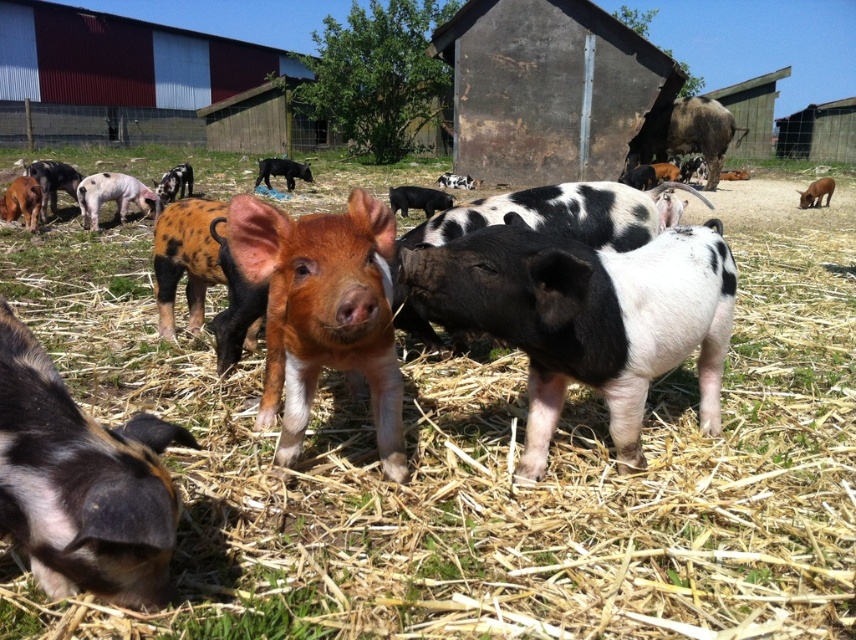
Between black and white speckled pig at center and brown furry piglet at center, which one has less height?

brown furry piglet at center is shorter.

Who is taller, black and white speckled pig at center or brown furry piglet at center?

Standing taller between the two is black and white speckled pig at center.

Locate an element on the screen. The height and width of the screenshot is (640, 856). black and white speckled pig at center is located at coordinates (586, 317).

Locate an element on the screen. black and white speckled pig at center is located at coordinates (586, 317).

Which is below, black and white speckled piglet at center or brown speckled piglet at lower left?

black and white speckled piglet at center

Between point (39, 538) and point (0, 212), which one is positioned in front?

Positioned in front is point (39, 538).

What are the coordinates of `black and white speckled piglet at center` in the screenshot? It's located at (x=81, y=483).

Does black and white speckled pig at center appear on the left side of brown textured pig at upper right?

Yes, black and white speckled pig at center is to the left of brown textured pig at upper right.

Describe the element at coordinates (586, 317) in the screenshot. Image resolution: width=856 pixels, height=640 pixels. I see `black and white speckled pig at center` at that location.

Locate an element on the screen. black and white speckled pig at center is located at coordinates (586, 317).

Identify the location of black and white speckled pig at center. (586, 317).